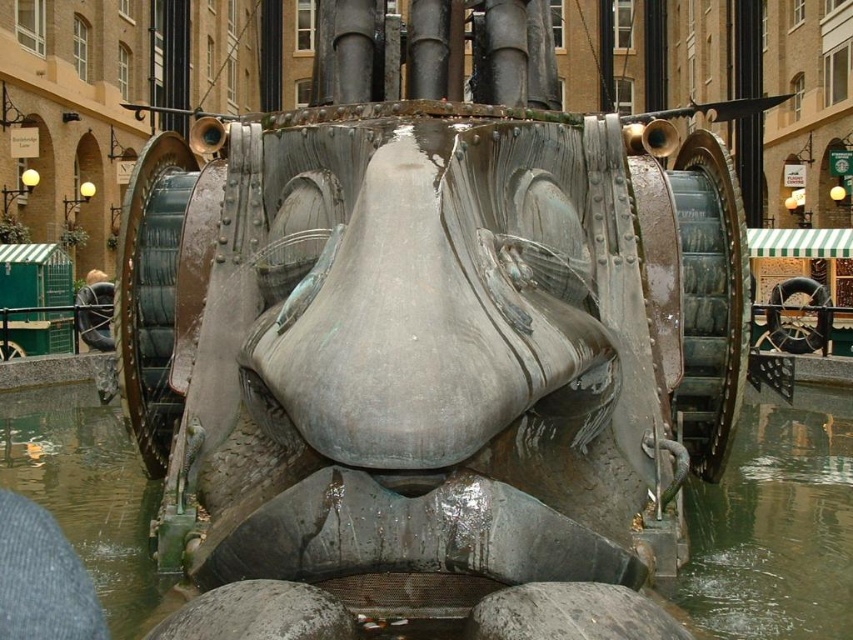
You are an urban planner assessing the sculpture for maintenance. You notice two water features in the sculpture. The first is the metallic gray water at center, and the second is the clear water at lower center. Which water feature requires more frequent cleaning based on their sizes?

The metallic gray water at center requires more frequent cleaning because it is larger in size than the clear water at lower center, and larger water features typically accumulate more debris and require more maintenance.

You are a maintenance worker inspecting the sculpture. You notice two areas of water around the sculpture. The metallic gray water at center and the clear water at lower center. Which area of water is higher in elevation?

The metallic gray water at center is much taller than the clear water at lower center, so the metallic gray water at center has a higher elevation.

You are standing in front of the sculpture and want to locate the metallic gray water at center. Where exactly should you look in terms of coordinates?

The metallic gray water at center is located at coordinates point (775,525).